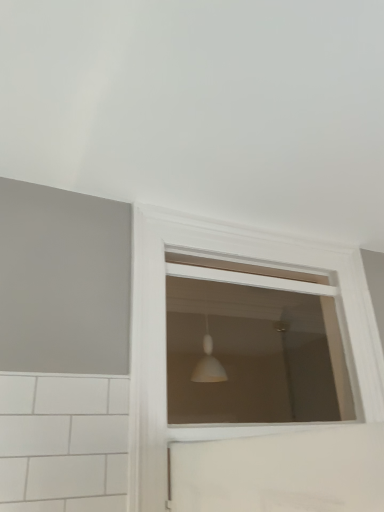
The height and width of the screenshot is (512, 384). What are the coordinates of `white matte window at center, placed as the 2th window when sorted from top to bottom` in the screenshot? It's located at (165, 332).

Measure the distance between point (140, 252) and camera.

The distance of point (140, 252) from camera is 4.76 feet.

This screenshot has width=384, height=512. What do you see at coordinates (165, 332) in the screenshot?
I see `white matte window at center, which is the 1th window from bottom to top` at bounding box center [165, 332].

Image resolution: width=384 pixels, height=512 pixels. Describe the element at coordinates (253, 344) in the screenshot. I see `white matte window at center, which is the second window in bottom-to-top order` at that location.

Identify the location of white matte window at center, acting as the 1th window starting from the top. The width and height of the screenshot is (384, 512). (253, 344).

The width and height of the screenshot is (384, 512). Identify the location of white matte window at center, which is the 1th window from bottom to top. (165, 332).

Does white matte window at center, which is the 1th window from bottom to top, appear on the left side of white matte window at center, acting as the 1th window starting from the top?

No, white matte window at center, which is the 1th window from bottom to top, is not to the left of white matte window at center, acting as the 1th window starting from the top.

Is white matte window at center, placed as the 2th window when sorted from top to bottom, behind white matte window at center, acting as the 1th window starting from the top?

No, white matte window at center, placed as the 2th window when sorted from top to bottom, is closer to the viewer.

Between point (293, 268) and point (323, 352), which one is positioned in front?

The point (293, 268) is closer.

From the image's perspective, between white matte window at center, which is the 1th window from bottom to top, and white matte window at center, which is the second window in bottom-to-top order, which one is located above?

white matte window at center, which is the second window in bottom-to-top order, from the image's perspective.

From a real-world perspective, who is located lower, white matte window at center, which is the 1th window from bottom to top, or white matte window at center, which is the second window in bottom-to-top order?

In real-world perspective, white matte window at center, which is the 1th window from bottom to top, is lower.

Is white matte window at center, placed as the 2th window when sorted from top to bottom, wider than white matte window at center, acting as the 1th window starting from the top?

Correct, the width of white matte window at center, placed as the 2th window when sorted from top to bottom, exceeds that of white matte window at center, acting as the 1th window starting from the top.

Is white matte window at center, which is the 1th window from bottom to top, shorter than white matte window at center, which is the second window in bottom-to-top order?

No.

Who is smaller, white matte window at center, which is the 1th window from bottom to top, or white matte window at center, acting as the 1th window starting from the top?

With smaller size is white matte window at center, acting as the 1th window starting from the top.

Is white matte window at center, which is the second window in bottom-to-top order, inside white matte window at center, which is the 1th window from bottom to top?

Yes, white matte window at center, which is the second window in bottom-to-top order, can be found within white matte window at center, which is the 1th window from bottom to top.

Is white matte window at center, which is the 1th window from bottom to top, directly adjacent to white matte window at center, acting as the 1th window starting from the top?

There is a gap between white matte window at center, which is the 1th window from bottom to top, and white matte window at center, acting as the 1th window starting from the top.

Is white matte window at center, which is the 1th window from bottom to top, oriented towards white matte window at center, which is the second window in bottom-to-top order?

Yes, white matte window at center, which is the 1th window from bottom to top, is turned towards white matte window at center, which is the second window in bottom-to-top order.

Measure the distance between white matte window at center, placed as the 2th window when sorted from top to bottom, and white matte window at center, acting as the 1th window starting from the top.

white matte window at center, placed as the 2th window when sorted from top to bottom, is 5.06 feet away from white matte window at center, acting as the 1th window starting from the top.

Identify the location of window that is below the white matte window at center, which is the second window in bottom-to-top order (from the image's perspective). (165, 332).

Which object is positioned more to the right, white matte window at center, which is the second window in bottom-to-top order, or white matte window at center, placed as the 2th window when sorted from top to bottom?

Positioned to the right is white matte window at center, placed as the 2th window when sorted from top to bottom.

Is the depth of white matte window at center, which is the second window in bottom-to-top order, less than that of white matte window at center, which is the 1th window from bottom to top?

No.

Which point is more distant from viewer, (208, 264) or (242, 426)?

The point (208, 264) is behind.

From the image's perspective, which is below, white matte window at center, which is the second window in bottom-to-top order, or white matte window at center, which is the 1th window from bottom to top?

white matte window at center, which is the 1th window from bottom to top, appears lower in the image.

From a real-world perspective, is white matte window at center, which is the second window in bottom-to-top order, under white matte window at center, which is the 1th window from bottom to top?

Incorrect, from a real-world perspective, white matte window at center, which is the second window in bottom-to-top order, is higher than white matte window at center, which is the 1th window from bottom to top.

Does white matte window at center, acting as the 1th window starting from the top, have a greater width compared to white matte window at center, which is the 1th window from bottom to top?

No, white matte window at center, acting as the 1th window starting from the top, is not wider than white matte window at center, which is the 1th window from bottom to top.

From their relative heights in the image, would you say white matte window at center, which is the second window in bottom-to-top order, is taller or shorter than white matte window at center, placed as the 2th window when sorted from top to bottom?

Clearly, white matte window at center, which is the second window in bottom-to-top order, is shorter compared to white matte window at center, placed as the 2th window when sorted from top to bottom.

Does white matte window at center, acting as the 1th window starting from the top, have a smaller size compared to white matte window at center, which is the 1th window from bottom to top?

Indeed, white matte window at center, acting as the 1th window starting from the top, has a smaller size compared to white matte window at center, which is the 1th window from bottom to top.

Is white matte window at center, which is the second window in bottom-to-top order, surrounding white matte window at center, which is the 1th window from bottom to top?

Absolutely, white matte window at center, which is the 1th window from bottom to top, is inside white matte window at center, which is the second window in bottom-to-top order.

Is white matte window at center, acting as the 1th window starting from the top, far away from white matte window at center, which is the 1th window from bottom to top?

Yes, white matte window at center, acting as the 1th window starting from the top, and white matte window at center, which is the 1th window from bottom to top, are located far from each other.

Is white matte window at center, acting as the 1th window starting from the top, facing away from white matte window at center, which is the 1th window from bottom to top?

Yes, white matte window at center, acting as the 1th window starting from the top, is positioned with its back facing white matte window at center, which is the 1th window from bottom to top.

Image resolution: width=384 pixels, height=512 pixels. In order to click on window lying on the right of white matte window at center, which is the second window in bottom-to-top order in this screenshot , I will do coord(165,332).

Identify the location of window above the white matte window at center, which is the 1th window from bottom to top (from the image's perspective). (253, 344).

Locate an element on the screen. Image resolution: width=384 pixels, height=512 pixels. window below the white matte window at center, acting as the 1th window starting from the top (from the image's perspective) is located at coordinates (165, 332).